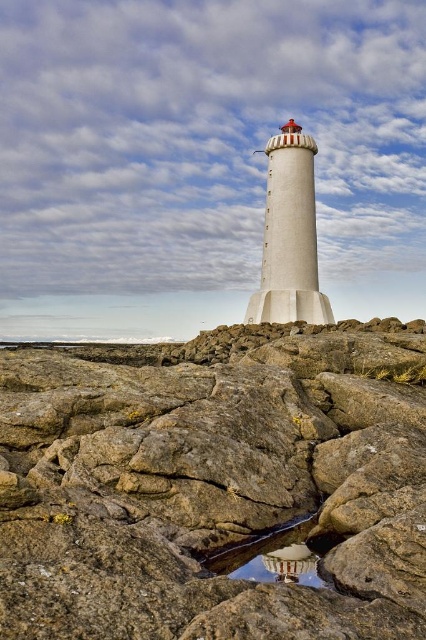
Who is higher up, brown rough rock at center or transparent glass puddle at center?

brown rough rock at center is above.

Between point (327, 413) and point (232, 573), which one is positioned in front?

Positioned in front is point (232, 573).

The width and height of the screenshot is (426, 640). What are the coordinates of `brown rough rock at center` in the screenshot? It's located at (213, 483).